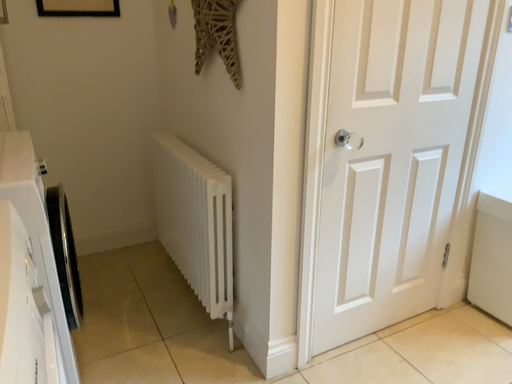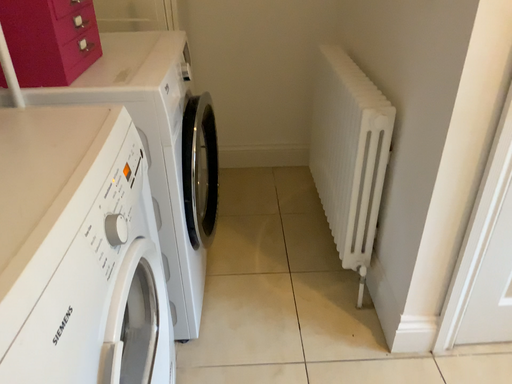
Question: How did the camera likely rotate when shooting the video?

Choices:
 (A) rotated upward
 (B) rotated downward

Answer: (B)